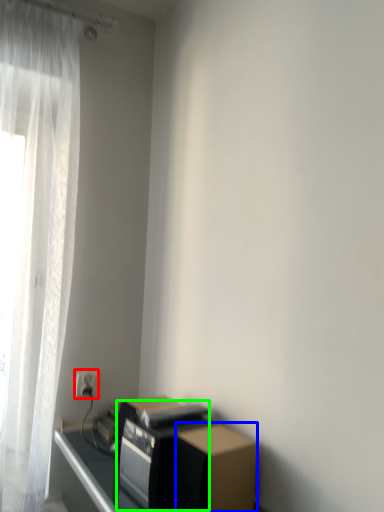
Question: Based on their relative distances, which object is nearer to electric outlet (highlighted by a red box)? Choose from cardboard box (highlighted by a blue box) and appliance (highlighted by a green box).

Choices:
 (A) cardboard box
 (B) appliance

Answer: (B)